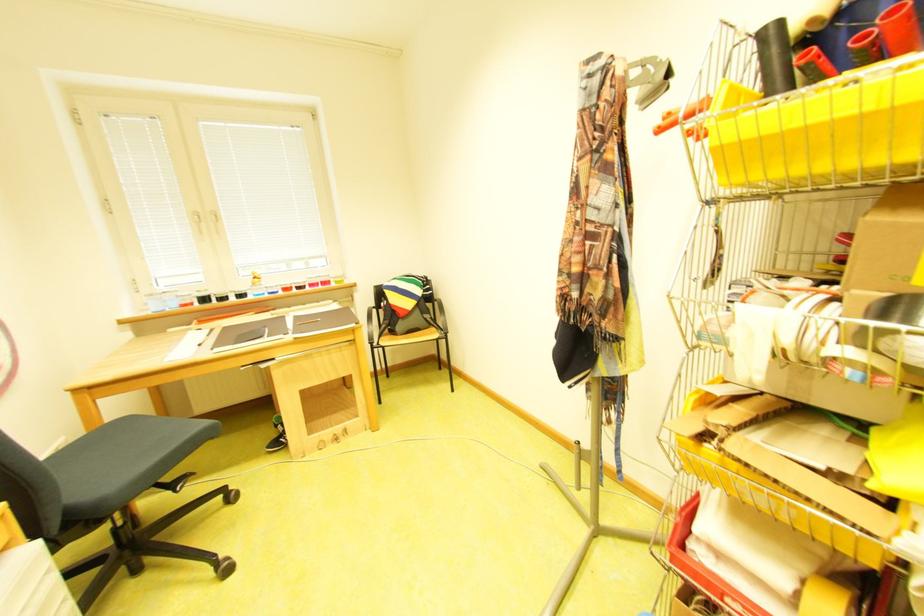
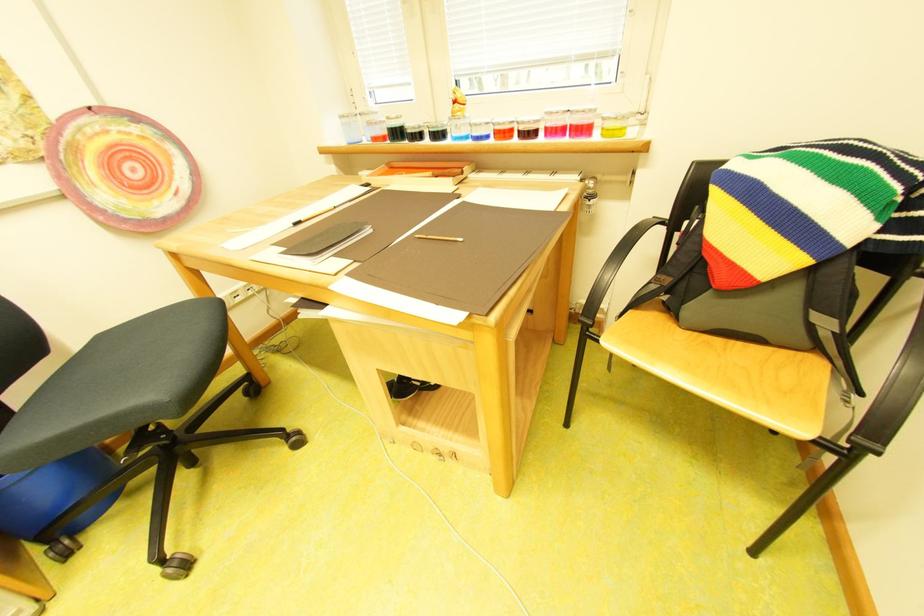
Where in the second image is the point corresponding to (277,289) from the first image?

(481, 126)